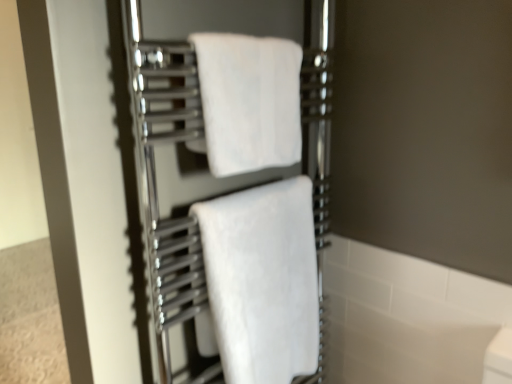
Where is `white soft towel at center, the second towel from the bottom`? The width and height of the screenshot is (512, 384). white soft towel at center, the second towel from the bottom is located at coordinates (249, 101).

The width and height of the screenshot is (512, 384). What do you see at coordinates (249, 101) in the screenshot?
I see `white soft towel at center, the first towel viewed from the top` at bounding box center [249, 101].

What is the approximate height of white soft towel at center, which appears as the 2th towel when viewed from the top?

21.59 inches.

I want to click on white soft towel at center, which appears as the 2th towel when viewed from the top, so click(262, 280).

Describe the element at coordinates (262, 280) in the screenshot. I see `white soft towel at center, positioned as the 1th towel in bottom-to-top order` at that location.

Image resolution: width=512 pixels, height=384 pixels. I want to click on white soft towel at center, the first towel viewed from the top, so click(249, 101).

Consider the image. Is white soft towel at center, positioned as the 1th towel in bottom-to-top order, at the right side of white soft towel at center, the second towel from the bottom?

Correct, you'll find white soft towel at center, positioned as the 1th towel in bottom-to-top order, to the right of white soft towel at center, the second towel from the bottom.

Which object is further away from the camera taking this photo, white soft towel at center, positioned as the 1th towel in bottom-to-top order, or white soft towel at center, the first towel viewed from the top?

white soft towel at center, positioned as the 1th towel in bottom-to-top order, is behind.

Is point (304, 186) closer to viewer compared to point (275, 71)?

No, it is not.

From the image's perspective, which one is positioned lower, white soft towel at center, which appears as the 2th towel when viewed from the top, or white soft towel at center, the first towel viewed from the top?

white soft towel at center, which appears as the 2th towel when viewed from the top, is shown below in the image.

From a real-world perspective, is white soft towel at center, positioned as the 1th towel in bottom-to-top order, physically located above or below white soft towel at center, the second towel from the bottom?

Clearly, from a real-world perspective, white soft towel at center, positioned as the 1th towel in bottom-to-top order, is below white soft towel at center, the second towel from the bottom.

Considering the sizes of objects white soft towel at center, positioned as the 1th towel in bottom-to-top order, and white soft towel at center, the second towel from the bottom, in the image provided, who is thinner, white soft towel at center, positioned as the 1th towel in bottom-to-top order, or white soft towel at center, the second towel from the bottom,?

white soft towel at center, the second towel from the bottom, is thinner.

Does white soft towel at center, which appears as the 2th towel when viewed from the top, have a greater height compared to white soft towel at center, the second towel from the bottom?

Indeed, white soft towel at center, which appears as the 2th towel when viewed from the top, has a greater height compared to white soft towel at center, the second towel from the bottom.

Considering the relative sizes of white soft towel at center, which appears as the 2th towel when viewed from the top, and white soft towel at center, the first towel viewed from the top, in the image provided, is white soft towel at center, which appears as the 2th towel when viewed from the top, smaller than white soft towel at center, the first towel viewed from the top,?

No.

Is white soft towel at center, which appears as the 2th towel when viewed from the top, not inside white soft towel at center, the first towel viewed from the top?

Indeed, white soft towel at center, which appears as the 2th towel when viewed from the top, is completely outside white soft towel at center, the first towel viewed from the top.

Consider the image. Is white soft towel at center, positioned as the 1th towel in bottom-to-top order, placed right next to white soft towel at center, the second towel from the bottom?

white soft towel at center, positioned as the 1th towel in bottom-to-top order, and white soft towel at center, the second towel from the bottom, are clearly separated.

Is white soft towel at center, the second towel from the bottom, at the back of white soft towel at center, which appears as the 2th towel when viewed from the top?

No.

What's the angular difference between white soft towel at center, positioned as the 1th towel in bottom-to-top order, and white soft towel at center, the second towel from the bottom,'s facing directions?

5.48 degrees separate the facing orientations of white soft towel at center, positioned as the 1th towel in bottom-to-top order, and white soft towel at center, the second towel from the bottom.

At what (x,y) coordinates should I click in order to perform the action: click on towel below the white soft towel at center, the first towel viewed from the top (from a real-world perspective). Please return your answer as a coordinate pair (x, y). Image resolution: width=512 pixels, height=384 pixels. Looking at the image, I should click on (262, 280).

Can you confirm if white soft towel at center, the first towel viewed from the top, is positioned to the left of white soft towel at center, positioned as the 1th towel in bottom-to-top order?

Indeed, white soft towel at center, the first towel viewed from the top, is positioned on the left side of white soft towel at center, positioned as the 1th towel in bottom-to-top order.

Considering the positions of objects white soft towel at center, the second towel from the bottom, and white soft towel at center, which appears as the 2th towel when viewed from the top, in the image provided, who is in front, white soft towel at center, the second towel from the bottom, or white soft towel at center, which appears as the 2th towel when viewed from the top,?

Positioned in front is white soft towel at center, the second towel from the bottom.

Which is behind, point (291, 96) or point (238, 336)?

Point (291, 96)

From the image's perspective, which is above, white soft towel at center, the second towel from the bottom, or white soft towel at center, positioned as the 1th towel in bottom-to-top order?

white soft towel at center, the second towel from the bottom, appears higher in the image.

From a real-world perspective, between white soft towel at center, the first towel viewed from the top, and white soft towel at center, which appears as the 2th towel when viewed from the top, who is vertically lower?

white soft towel at center, which appears as the 2th towel when viewed from the top, from a real-world perspective.

Considering the relative sizes of white soft towel at center, the first towel viewed from the top, and white soft towel at center, positioned as the 1th towel in bottom-to-top order, in the image provided, is white soft towel at center, the first towel viewed from the top, thinner than white soft towel at center, positioned as the 1th towel in bottom-to-top order,?

Yes.

Can you confirm if white soft towel at center, the second towel from the bottom, is shorter than white soft towel at center, which appears as the 2th towel when viewed from the top?

Indeed, white soft towel at center, the second towel from the bottom, has a lesser height compared to white soft towel at center, which appears as the 2th towel when viewed from the top.

Between white soft towel at center, the first towel viewed from the top, and white soft towel at center, positioned as the 1th towel in bottom-to-top order, which one has smaller size?

white soft towel at center, the first towel viewed from the top, is smaller.

Does white soft towel at center, the second towel from the bottom, contain white soft towel at center, positioned as the 1th towel in bottom-to-top order?

Definitely not — white soft towel at center, positioned as the 1th towel in bottom-to-top order, is not inside white soft towel at center, the second towel from the bottom.

Is white soft towel at center, the second towel from the bottom, in contact with white soft towel at center, positioned as the 1th towel in bottom-to-top order?

There is a gap between white soft towel at center, the second towel from the bottom, and white soft towel at center, positioned as the 1th towel in bottom-to-top order.

Could you tell me if white soft towel at center, the first towel viewed from the top, is facing white soft towel at center, which appears as the 2th towel when viewed from the top?

No, white soft towel at center, the first towel viewed from the top, is not turned towards white soft towel at center, which appears as the 2th towel when viewed from the top.

Where is `towel positioned vertically above the white soft towel at center, which appears as the 2th towel when viewed from the top (from a real-world perspective)`? The image size is (512, 384). towel positioned vertically above the white soft towel at center, which appears as the 2th towel when viewed from the top (from a real-world perspective) is located at coordinates (249, 101).

Where is `towel on the left of white soft towel at center, positioned as the 1th towel in bottom-to-top order`? This screenshot has width=512, height=384. towel on the left of white soft towel at center, positioned as the 1th towel in bottom-to-top order is located at coordinates [249, 101].

What are the coordinates of `towel below the white soft towel at center, the second towel from the bottom (from the image's perspective)` in the screenshot? It's located at (262, 280).